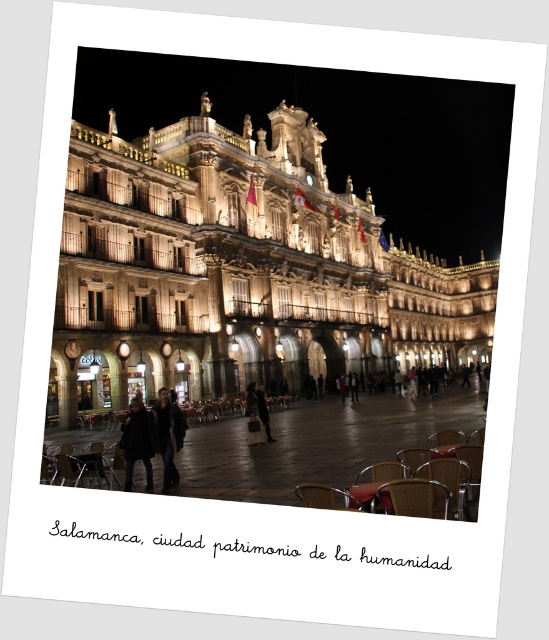
Consider the image. You are a photographer planning to capture a wide shot of the Salamanca building while ensuring both the dark wool coat at center and the wooden chair at lower center are in the frame. Given their sizes, which object would require more space in the foreground to avoid being cropped out?

The dark wool coat at center requires more space in the foreground because its width surpasses that of the wooden chair at lower center, meaning it occupies a larger area in the frame.

You are standing in the plaza in front of the illuminated Salamanca building. You see a wooden chair at lower right and a woven wood chair at lower center. Which chair is positioned more to the right side of the plaza?

The wooden chair at lower right is positioned more to the right side of the plaza because it is located to the right of the woven wood chair at lower center.